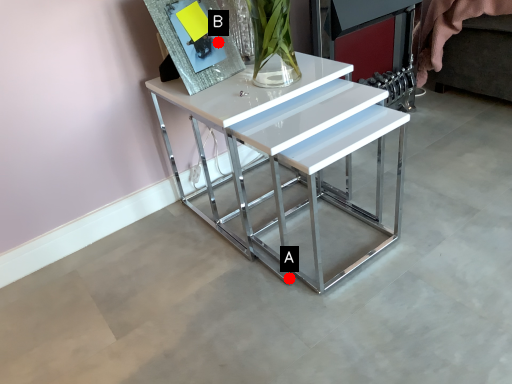
Question: Two points are circled on the image, labeled by A and B beside each circle. Which of the following is the closest to the observer?

Choices:
 (A) A is closer
 (B) B is closer

Answer: (A)